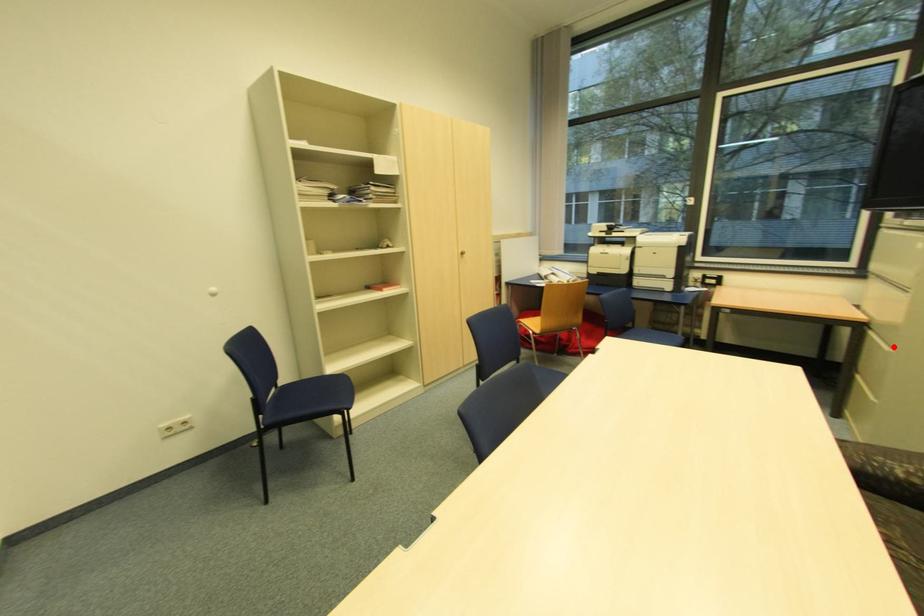
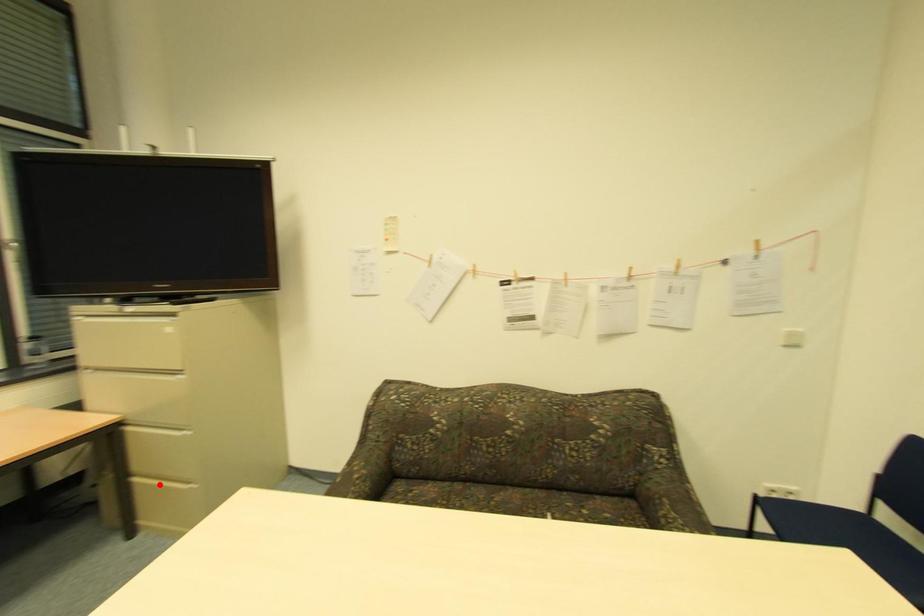
I am providing you with two images of the same scene from different viewpoints. A red point is marked on the first image and another point is marked on the second image. Is the red point in image1 aligned with the point shown in image2?

No